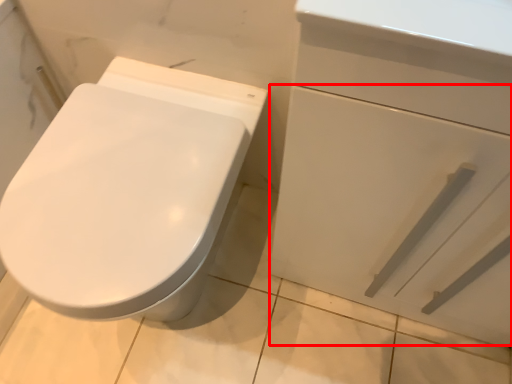
Question: From the image, what is the correct spatial relationship of drawer (annotated by the red box) in relation to bidet?

Choices:
 (A) right
 (B) left

Answer: (A)